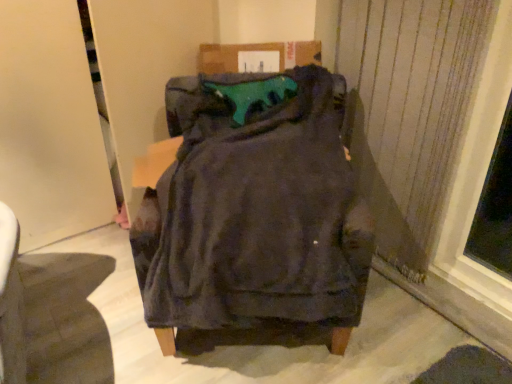
Question: Does teal fabric cushion at center appear on the left side of dark fabric chair at center?

Choices:
 (A) no
 (B) yes

Answer: (A)

Question: From a real-world perspective, is teal fabric cushion at center beneath dark fabric chair at center?

Choices:
 (A) no
 (B) yes

Answer: (A)

Question: Does teal fabric cushion at center turn towards dark fabric chair at center?

Choices:
 (A) no
 (B) yes

Answer: (B)

Question: Can you confirm if teal fabric cushion at center is bigger than dark fabric chair at center?

Choices:
 (A) no
 (B) yes

Answer: (A)

Question: From the image's perspective, is teal fabric cushion at center above dark fabric chair at center?

Choices:
 (A) no
 (B) yes

Answer: (B)

Question: Considering the relative positions of teal fabric cushion at center and dark fabric chair at center in the image provided, is teal fabric cushion at center to the right of dark fabric chair at center from the viewer's perspective?

Choices:
 (A) yes
 (B) no

Answer: (A)

Question: From the image's perspective, does satin fabric curtain at right appear lower than teal fabric cushion at center?

Choices:
 (A) no
 (B) yes

Answer: (B)

Question: Is satin fabric curtain at right closer to camera compared to teal fabric cushion at center?

Choices:
 (A) no
 (B) yes

Answer: (B)

Question: Is satin fabric curtain at right facing away from teal fabric cushion at center?

Choices:
 (A) no
 (B) yes

Answer: (A)

Question: Does satin fabric curtain at right have a greater width compared to teal fabric cushion at center?

Choices:
 (A) yes
 (B) no

Answer: (B)

Question: Is satin fabric curtain at right positioned beyond the bounds of teal fabric cushion at center?

Choices:
 (A) yes
 (B) no

Answer: (A)

Question: Are satin fabric curtain at right and teal fabric cushion at center located far from each other?

Choices:
 (A) no
 (B) yes

Answer: (A)

Question: Does dark fabric chair at center have a lesser height compared to teal fabric cushion at center?

Choices:
 (A) yes
 (B) no

Answer: (B)